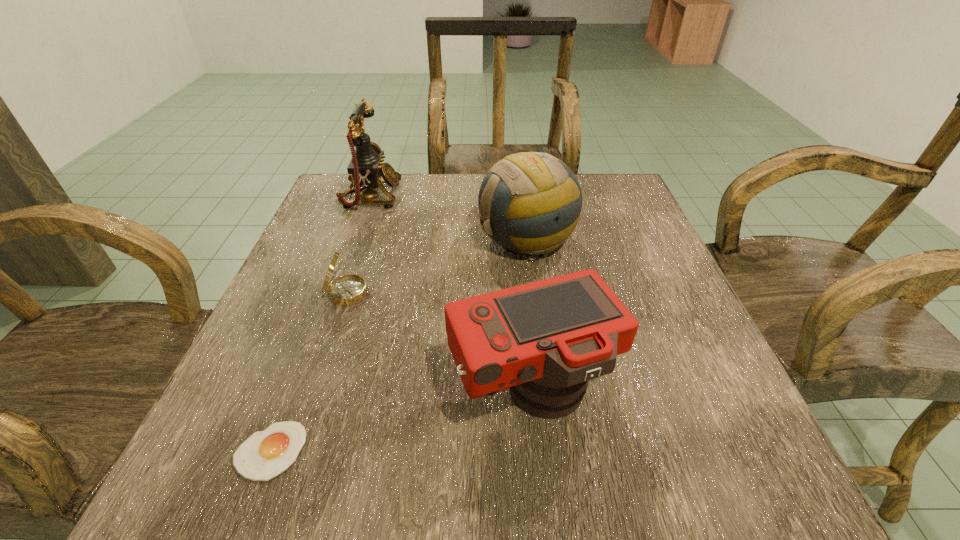
Image resolution: width=960 pixels, height=540 pixels. Identify the location of vacant space at the far edge of the desktop. (462, 204).

Image resolution: width=960 pixels, height=540 pixels. In the image, there is a desktop. Identify the location of vacant region at the near edge. (448, 439).

Locate an element on the screen. This screenshot has height=540, width=960. vacant space at the left edge is located at coordinates (341, 254).

In order to click on vacant space at the right edge of the desktop in this screenshot , I will do `click(585, 237)`.

The height and width of the screenshot is (540, 960). What are the coordinates of `vacant space at the far left corner of the desktop` in the screenshot? It's located at (382, 215).

Locate an element on the screen. vacant position at the near left corner of the desktop is located at coordinates (314, 456).

At what (x,y) coordinates should I click in order to perform the action: click on free spot at the far right corner of the desktop. Please return your answer as a coordinate pair (x, y). Image resolution: width=960 pixels, height=540 pixels. Looking at the image, I should click on (606, 177).

At what (x,y) coordinates should I click in order to perform the action: click on free space at the near right corner of the desktop. Please return your answer as a coordinate pair (x, y). Looking at the image, I should click on [x=767, y=466].

At what (x,y) coordinates should I click in order to perform the action: click on free spot between the volleyball and the compass. Please return your answer as a coordinate pair (x, y). The width and height of the screenshot is (960, 540). Looking at the image, I should click on (439, 266).

Identify the location of vacant point located between the compass and the shortest object. (310, 372).